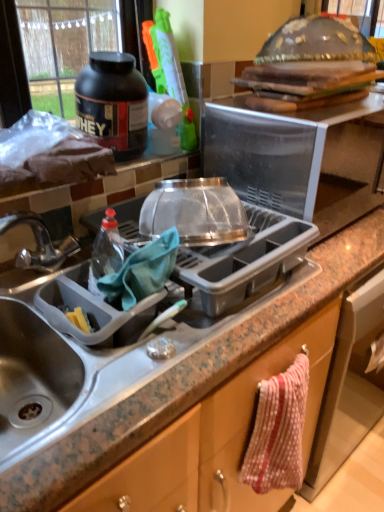
Question: Is there a large distance between black matte protein powder container at upper left and transparent plastic microwave at upper center, marked as the 2th appliance in a bottom-to-top arrangement?

Choices:
 (A) no
 (B) yes

Answer: (A)

Question: Is black matte protein powder container at upper left oriented towards transparent plastic microwave at upper center, marked as the 2th appliance in a bottom-to-top arrangement?

Choices:
 (A) no
 (B) yes

Answer: (A)

Question: Can you confirm if black matte protein powder container at upper left is taller than transparent plastic microwave at upper center, marked as the 2th appliance in a bottom-to-top arrangement?

Choices:
 (A) yes
 (B) no

Answer: (B)

Question: Is black matte protein powder container at upper left closer to the viewer compared to transparent plastic microwave at upper center, placed as the first appliance when sorted from top to bottom?

Choices:
 (A) no
 (B) yes

Answer: (A)

Question: From a real-world perspective, is black matte protein powder container at upper left beneath transparent plastic microwave at upper center, marked as the 2th appliance in a bottom-to-top arrangement?

Choices:
 (A) no
 (B) yes

Answer: (A)

Question: Considering the relative sizes of black matte protein powder container at upper left and transparent plastic microwave at upper center, marked as the 2th appliance in a bottom-to-top arrangement, in the image provided, is black matte protein powder container at upper left bigger than transparent plastic microwave at upper center, marked as the 2th appliance in a bottom-to-top arrangement,?

Choices:
 (A) no
 (B) yes

Answer: (A)

Question: Are polka dot fabric towel at lower right and granite gray sink at lower left located far from each other?

Choices:
 (A) yes
 (B) no

Answer: (B)

Question: Does polka dot fabric towel at lower right appear on the left side of granite gray sink at lower left?

Choices:
 (A) no
 (B) yes

Answer: (A)

Question: Does polka dot fabric towel at lower right have a lesser width compared to granite gray sink at lower left?

Choices:
 (A) yes
 (B) no

Answer: (A)

Question: Is polka dot fabric towel at lower right positioned in front of granite gray sink at lower left?

Choices:
 (A) no
 (B) yes

Answer: (A)

Question: Considering the relative positions of polka dot fabric towel at lower right and granite gray sink at lower left in the image provided, is polka dot fabric towel at lower right to the right of granite gray sink at lower left from the viewer's perspective?

Choices:
 (A) yes
 (B) no

Answer: (A)

Question: Is granite gray sink at lower left inside polka dot fabric towel at lower right?

Choices:
 (A) no
 (B) yes

Answer: (A)

Question: Would you consider metallic sink at left to be distant from granite gray sink at lower left?

Choices:
 (A) yes
 (B) no

Answer: (B)